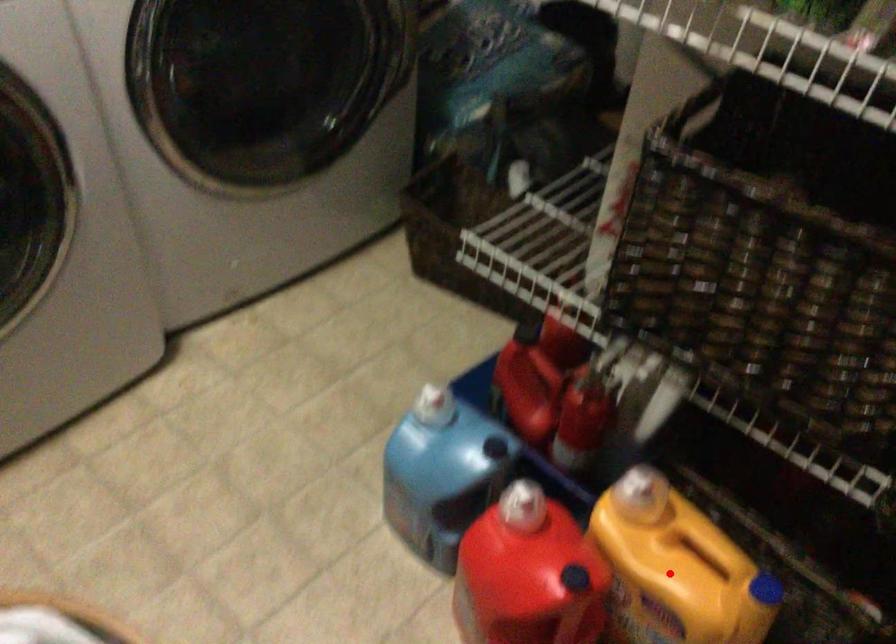
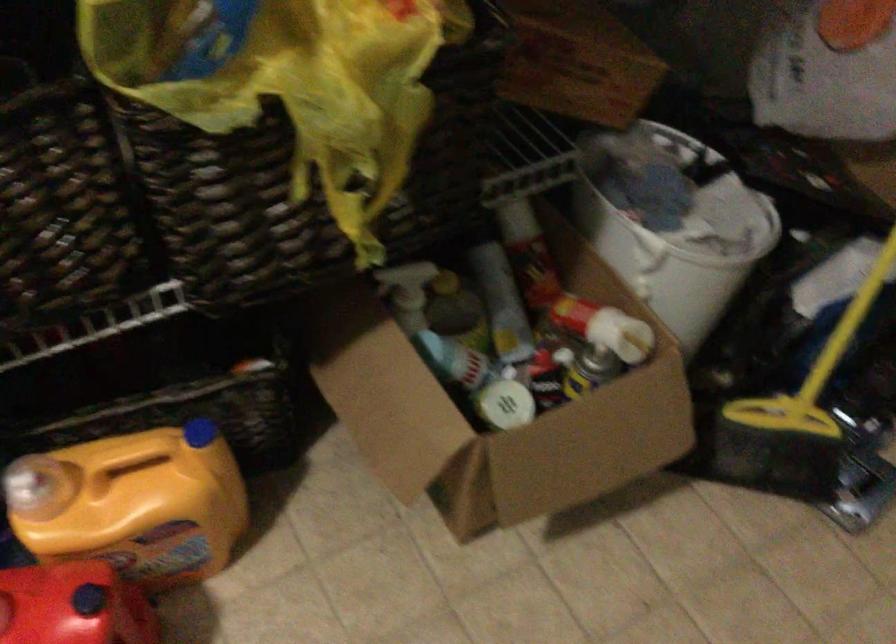
Find the pixel in the second image that matches the highlighted location in the first image.

(133, 504)